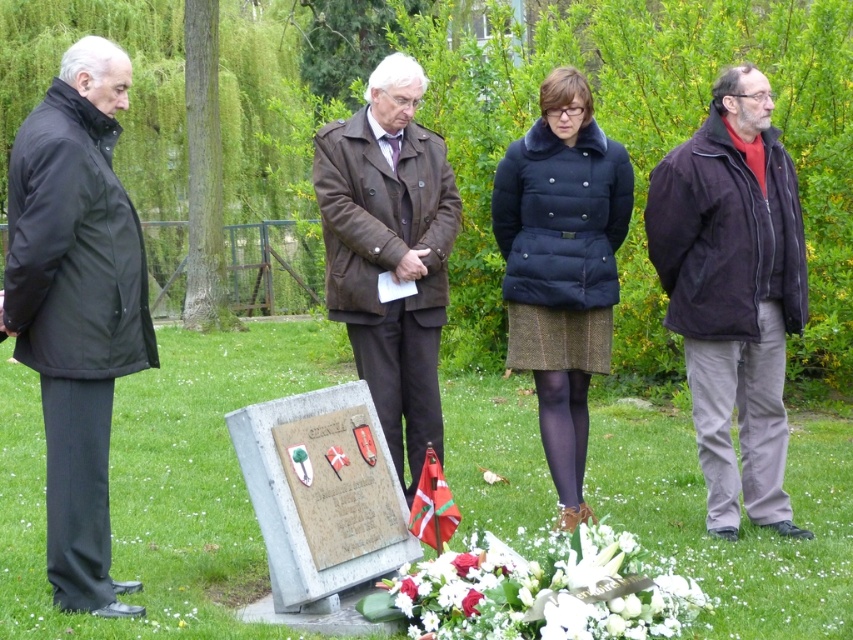
You are a photographer taking a group photo of the black matte jacket at left and the white floral bouquet at lower center. Which object should you focus on first if you want to ensure both are in frame and the larger one is properly highlighted?

The black matte jacket at left is larger in size than the white floral bouquet at lower center, so you should focus on the black matte jacket at left first to ensure it is properly highlighted while keeping both in frame.

Consider the image. You are a photographer trying to capture a clear photo of the memorial plaque. You notice the brown leather coat at center and the white floral bouquet at lower center might block the view. Which object is narrower and less likely to obstruct the plaque?

The brown leather coat at center is thinner than the white floral bouquet at lower center, so it is narrower and less likely to obstruct the plaque.

You are a photographer trying to capture a photo of the memorial plaque. You notice the black matte jacket at left and the white floral bouquet at lower center in your shot. Which object should you move to the right to ensure the memorial plaque is centered in the frame?

You should move the black matte jacket at left to the right since it is currently to the left of the white floral bouquet at lower center, which is at lower center. Moving the black matte jacket at left to the right would help center the memorial plaque in the frame.